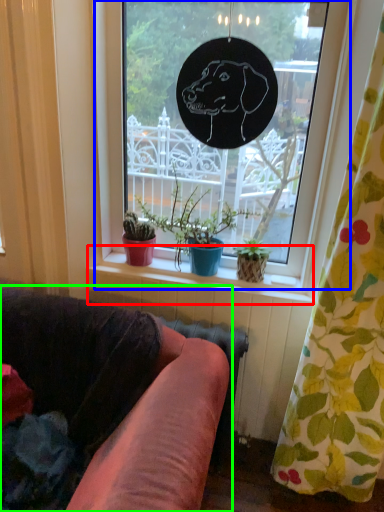
Question: Based on their relative distances, which object is farther from window sill (highlighted by a red box)? Choose from window (highlighted by a blue box) and studio couch (highlighted by a green box).

Choices:
 (A) window
 (B) studio couch

Answer: (B)